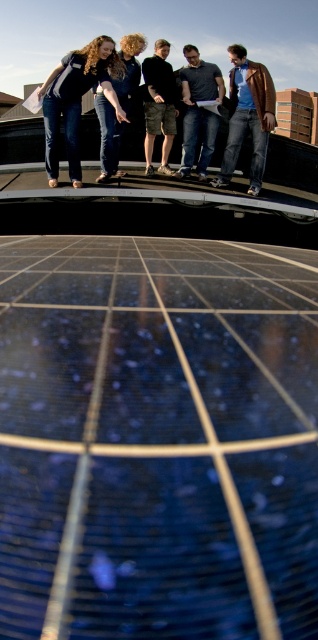
You are standing on the rooftop and want to take a photo of both point (261, 113) and point (186, 144). Which point should you focus on first to ensure both are in sharp focus?

You should focus on point (261, 113) first because it is closer to the camera than point (186, 144). By focusing on the closer point, the farther point will also be within the depth of field and in focus.

You are standing at the point marked as point (159, 106) on the rooftop. Which object is exactly at your current position?

The camouflage shorts at center is located at point (159, 106).